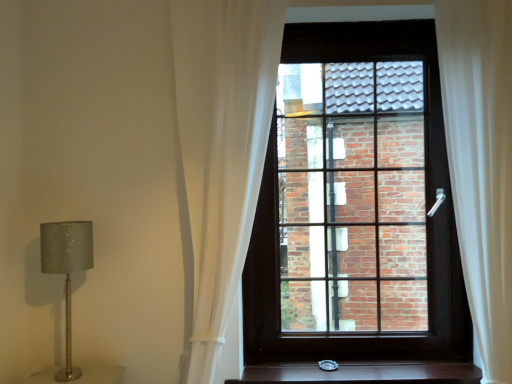
Question: Is wooden stair treads at lower center smaller than silver textured lamp at left?

Choices:
 (A) no
 (B) yes

Answer: (B)

Question: From a real-world perspective, does wooden stair treads at lower center stand above silver textured lamp at left?

Choices:
 (A) yes
 (B) no

Answer: (B)

Question: From a real-world perspective, is wooden stair treads at lower center under silver textured lamp at left?

Choices:
 (A) yes
 (B) no

Answer: (A)

Question: Does wooden stair treads at lower center have a greater width compared to silver textured lamp at left?

Choices:
 (A) yes
 (B) no

Answer: (A)

Question: Is wooden stair treads at lower center in contact with silver textured lamp at left?

Choices:
 (A) no
 (B) yes

Answer: (A)

Question: Does point (390, 365) appear closer or farther from the camera than point (173, 11)?

Choices:
 (A) closer
 (B) farther

Answer: (B)

Question: Is wooden stair treads at lower center taller or shorter than white sheer curtain at center, the 2th curtain in the right-to-left sequence?

Choices:
 (A) tall
 (B) short

Answer: (B)

Question: Based on their sizes in the image, would you say wooden stair treads at lower center is bigger or smaller than white sheer curtain at center, the 1th curtain when ordered from left to right?

Choices:
 (A) small
 (B) big

Answer: (A)

Question: Looking at their shapes, would you say wooden stair treads at lower center is wider or thinner than white sheer curtain at center, the 1th curtain when ordered from left to right?

Choices:
 (A) wide
 (B) thin

Answer: (A)

Question: From a real-world perspective, is white sheer curtain at right, positioned as the first curtain in right-to-left order, positioned above or below silver textured lamp at left?

Choices:
 (A) above
 (B) below

Answer: (A)

Question: In terms of width, does white sheer curtain at right, positioned as the first curtain in right-to-left order, look wider or thinner when compared to silver textured lamp at left?

Choices:
 (A) thin
 (B) wide

Answer: (B)

Question: Is white sheer curtain at right, which is the 2th curtain from left to right, inside the boundaries of silver textured lamp at left, or outside?

Choices:
 (A) outside
 (B) inside

Answer: (A)

Question: In terms of height, does white sheer curtain at right, which is the 2th curtain from left to right, look taller or shorter compared to silver textured lamp at left?

Choices:
 (A) short
 (B) tall

Answer: (B)

Question: Is silver textured lamp at left taller or shorter than white sheer curtain at center, the 1th curtain when ordered from left to right?

Choices:
 (A) tall
 (B) short

Answer: (B)

Question: Is point (86, 256) positioned closer to the camera than point (254, 110)?

Choices:
 (A) closer
 (B) farther

Answer: (A)